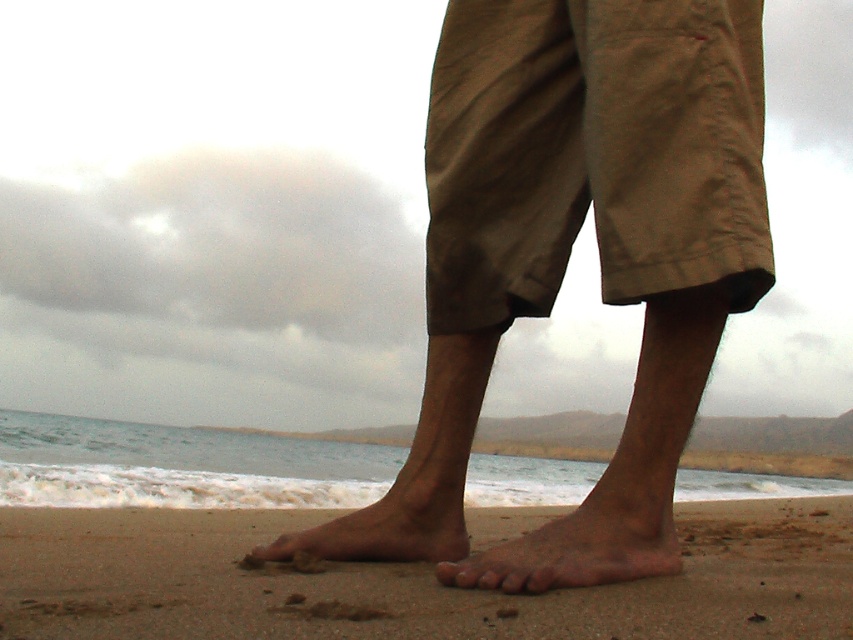
You are a photographer trying to capture the khaki cotton shorts at center in a beach scene. The camera you are using has a focus point at coordinates 0.241, 0.696. Will the focus point align with the khaki shorts?

The 2D location of khaki cotton shorts at center is at point (593, 154), so yes, the focus point at (593, 154) will align with the khaki cotton shorts at center.

Based on the photo, you are a lifeguard on duty and notice a swimmer in distress 20 meters away. You need to run from your current position to reach them quickly. Given that the brown sand at lower center is 17.86 centimeters from the dry skin foot at lower center, can you estimate if you can step onto the sand without slipping?

The brown sand at lower center is 17.86 centimeters away from the dry skin foot at lower center. Since the distance between them is less than 20 meters, you can step onto the sand safely without slipping.